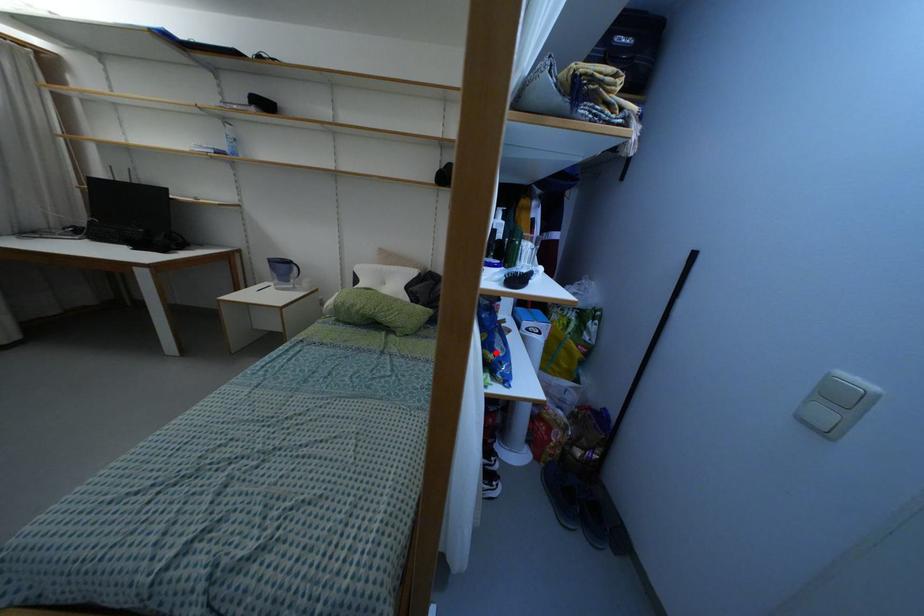
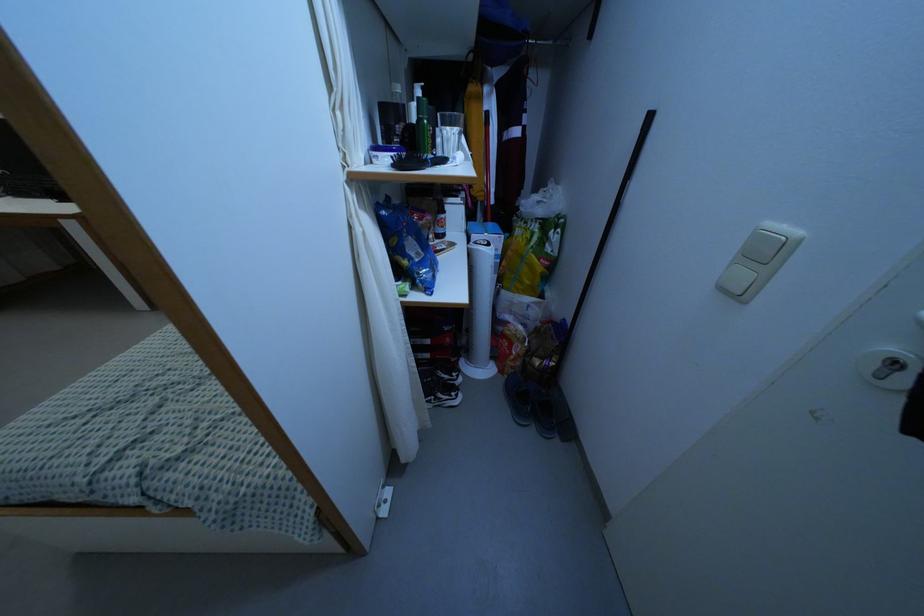
Question: I am providing you with two images of the same scene from different viewpoints. Image1 has a red point marked. In image2, the corresponding 3D location appears at what relative position? Reply with the corresponding letter.

Choices:
 (A) Closer
 (B) Farther

Answer: (A)